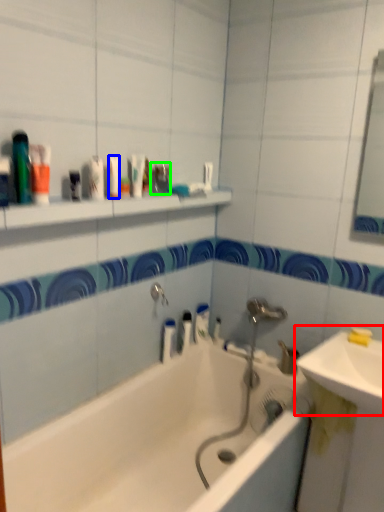
Question: Which is farther away from sink (highlighted by a red box)? mouthwash (highlighted by a blue box) or toiletry (highlighted by a green box)?

Choices:
 (A) mouthwash
 (B) toiletry

Answer: (A)